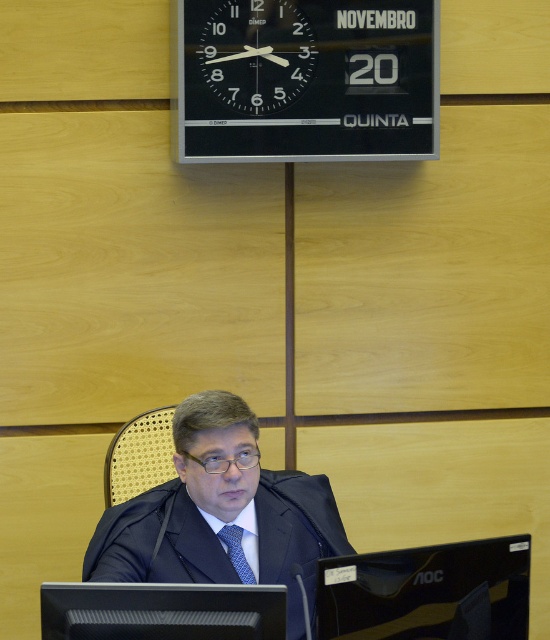
Please describe the object located at the coordinates point [221,513] in the image.

The object at point [221,513] is the matte black suit at center.

You are an interior designer assessing the courtroom layout. The black glass clock at upper center and the blue silk tie at center are both important elements. Which object is taller in the scene?

The black glass clock at upper center is taller than the blue silk tie at center.

You are a visitor in the courtroom and need to check the time. You see the black glass clock at upper center and the blue silk tie at center. Which object is bigger?

The black glass clock at upper center is larger in size than the blue silk tie at center, so the clock is bigger.